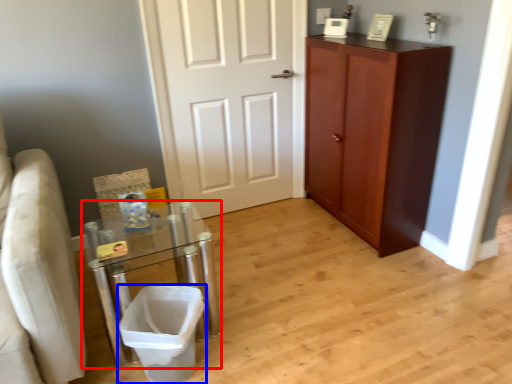
Question: Which object is closer to the camera taking this photo, table (highlighted by a red box) or laundry basket (highlighted by a blue box)?

Choices:
 (A) table
 (B) laundry basket

Answer: (B)